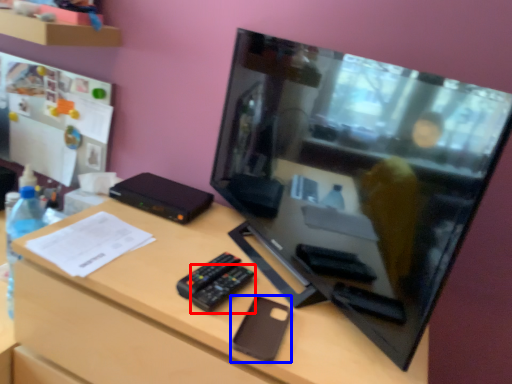
Question: Which of the following is the farthest to the observer, control (highlighted by a red box) or gadget (highlighted by a blue box)?

Choices:
 (A) control
 (B) gadget

Answer: (A)